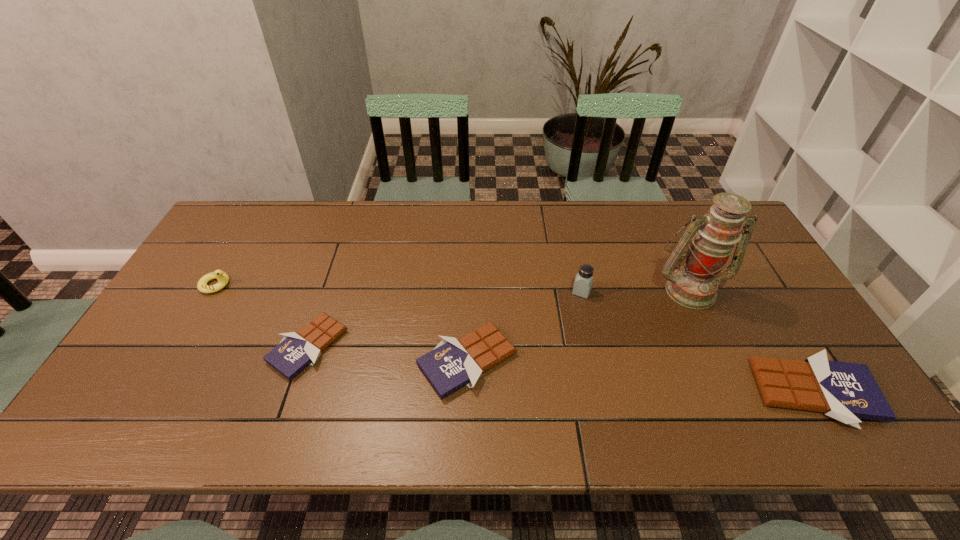
In the image, there is a desktop. At what (x,y) coordinates should I click in order to perform the action: click on vacant space at the far edge. Please return your answer as a coordinate pair (x, y). The height and width of the screenshot is (540, 960). Looking at the image, I should click on (595, 203).

This screenshot has height=540, width=960. Identify the location of free region at the near edge of the desktop. (657, 396).

In order to click on free location at the left edge in this screenshot , I will do `click(167, 357)`.

Find the location of a particular element. This screenshot has width=960, height=540. blank space at the right edge of the desktop is located at coordinates (761, 308).

Identify the location of vacant position at the far right corner of the desktop. (702, 201).

I want to click on free point between the tallest object and the second chocolate bar from right to left, so click(578, 325).

Locate an element on the screen. The height and width of the screenshot is (540, 960). empty space that is in between the second tallest object and the leftmost chocolate bar is located at coordinates (444, 319).

Image resolution: width=960 pixels, height=540 pixels. I want to click on vacant point located between the leftmost object and the second chocolate bar from left to right, so 342,323.

Where is `vacant area that lies between the fourth shortest object and the fifth tallest object`? vacant area that lies between the fourth shortest object and the fifth tallest object is located at coordinates (342, 323).

Identify the location of unoccupied position between the third object from left to right and the leftmost object. This screenshot has width=960, height=540. (342, 323).